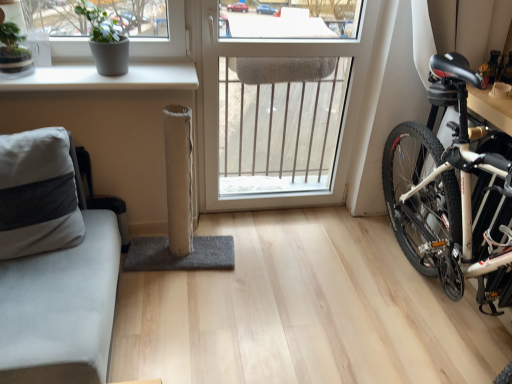
Identify the location of vacant area that is in front of gray matte pot at upper left. pos(96,84).